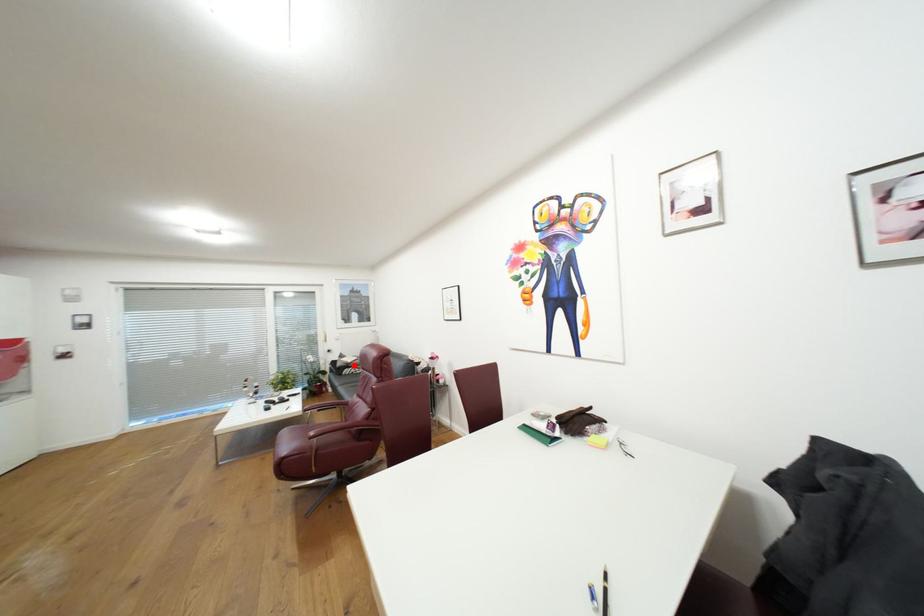
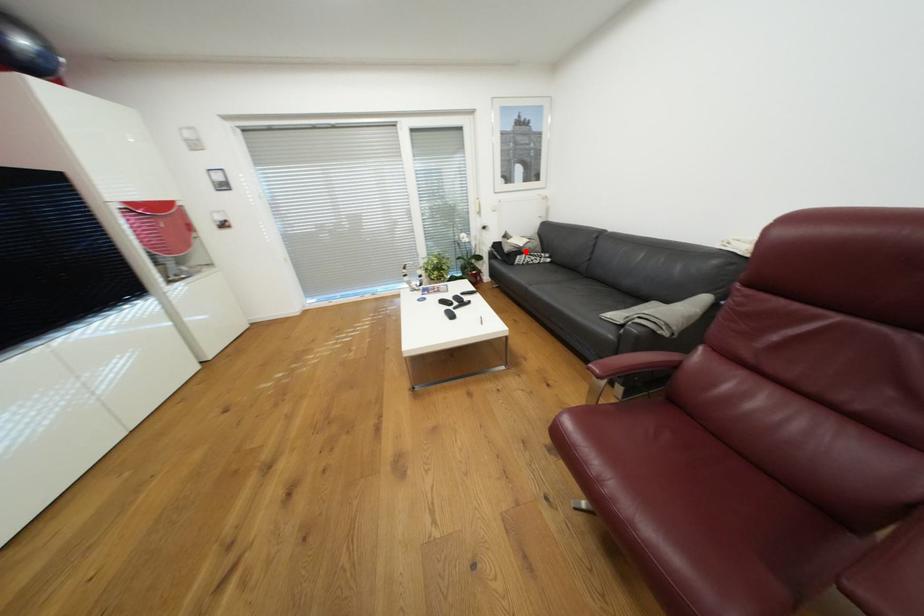
I am providing you with two images of the same scene from different viewpoints. A red point is marked on the first image and another point is marked on the second image. Does the point marked in image1 correspond to the same location as the one in image2?

Yes